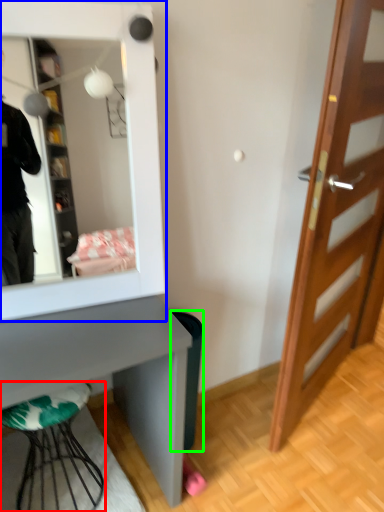
Question: Which object is positioned farthest from furniture (highlighted by a red box)? Select from mirror (highlighted by a blue box) and trash bin/can (highlighted by a green box).

Choices:
 (A) mirror
 (B) trash bin/can

Answer: (A)